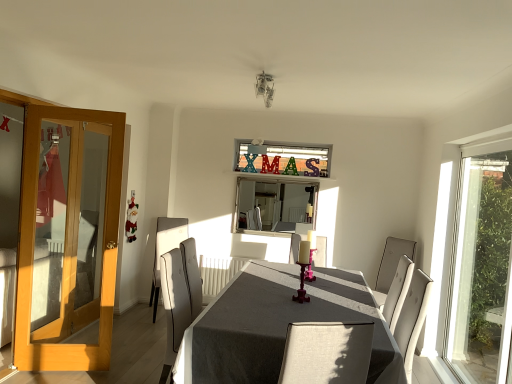
Identify the location of vacant area that is in front of pink glossy candle holder at center. (300, 307).